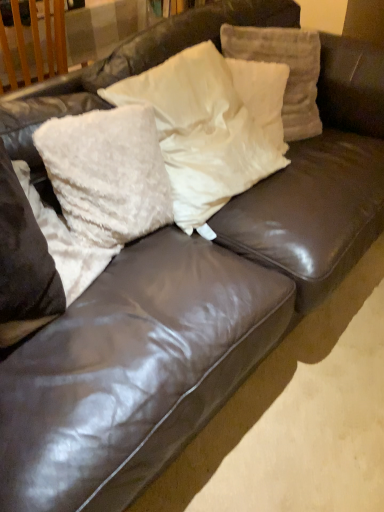
Question: Does white fluffy pillow at left, which is the first pillow from left to right, turn towards white fluffy pillow at center, the 3th pillow positioned from the left?

Choices:
 (A) no
 (B) yes

Answer: (A)

Question: From a real-world perspective, is white fluffy pillow at left, which is the first pillow from left to right, below white fluffy pillow at center, the 3th pillow positioned from the left?

Choices:
 (A) yes
 (B) no

Answer: (A)

Question: Considering the relative sizes of white fluffy pillow at left, which is the first pillow from left to right, and white fluffy pillow at center, the 3th pillow positioned from the left, in the image provided, is white fluffy pillow at left, which is the first pillow from left to right, wider than white fluffy pillow at center, the 3th pillow positioned from the left,?

Choices:
 (A) yes
 (B) no

Answer: (A)

Question: Is white fluffy pillow at left, arranged as the fifth pillow when viewed from the right, smaller than white fluffy pillow at center, marked as the 3th pillow in a right-to-left arrangement?

Choices:
 (A) yes
 (B) no

Answer: (A)

Question: Is white fluffy pillow at center, the 3th pillow positioned from the left, inside white fluffy pillow at left, which is the first pillow from left to right?

Choices:
 (A) yes
 (B) no

Answer: (B)

Question: Considering their positions, is white fluffy pillow at upper center, positioned as the fourth pillow in left-to-right order, located in front of or behind white fluffy pillow at center, the 3th pillow positioned from the left?

Choices:
 (A) front
 (B) behind

Answer: (B)

Question: Based on their sizes in the image, would you say white fluffy pillow at upper center, arranged as the 2th pillow when viewed from the right, is bigger or smaller than white fluffy pillow at center, marked as the 3th pillow in a right-to-left arrangement?

Choices:
 (A) big
 (B) small

Answer: (B)

Question: Considering the positions of white fluffy pillow at upper center, arranged as the 2th pillow when viewed from the right, and white fluffy pillow at center, the 3th pillow positioned from the left, in the image, is white fluffy pillow at upper center, arranged as the 2th pillow when viewed from the right, wider or thinner than white fluffy pillow at center, the 3th pillow positioned from the left,?

Choices:
 (A) wide
 (B) thin

Answer: (B)

Question: From a real-world perspective, is white fluffy pillow at upper center, arranged as the 2th pillow when viewed from the right, physically located above or below white fluffy pillow at center, marked as the 3th pillow in a right-to-left arrangement?

Choices:
 (A) above
 (B) below

Answer: (B)

Question: Is white fluffy pillow at left, which is the first pillow from left to right, wider or thinner than white fluffy pillow at upper center, which is the fifth pillow in left-to-right order?

Choices:
 (A) wide
 (B) thin

Answer: (A)

Question: Would you say white fluffy pillow at left, arranged as the fifth pillow when viewed from the right, is to the left or to the right of white fluffy pillow at upper center, the 1th pillow positioned from the right, in the picture?

Choices:
 (A) right
 (B) left

Answer: (B)

Question: Is point (64, 237) positioned closer to the camera than point (258, 33)?

Choices:
 (A) closer
 (B) farther

Answer: (A)

Question: From the image's perspective, is white fluffy pillow at left, arranged as the fifth pillow when viewed from the right, above or below white fluffy pillow at upper center, which is the fifth pillow in left-to-right order?

Choices:
 (A) above
 (B) below

Answer: (B)

Question: Is white fluffy pillow at center, arranged as the 2th pillow when viewed from the left, situated inside white fluffy pillow at left, arranged as the fifth pillow when viewed from the right, or outside?

Choices:
 (A) outside
 (B) inside

Answer: (A)

Question: From the image's perspective, is white fluffy pillow at center, arranged as the 2th pillow when viewed from the left, above or below white fluffy pillow at left, which is the first pillow from left to right?

Choices:
 (A) above
 (B) below

Answer: (A)